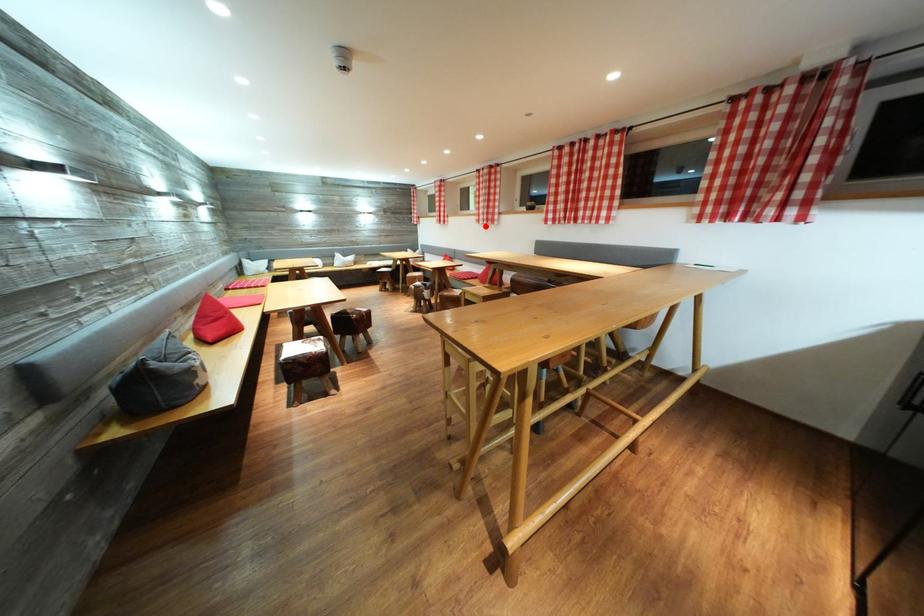
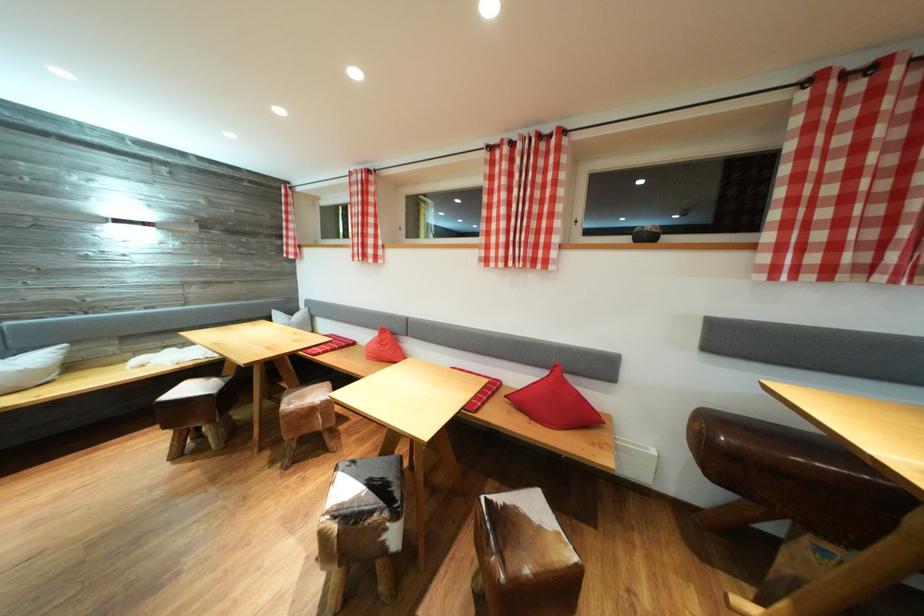
The point at the highlighted location is marked in the first image. Where is the corresponding point in the second image?

(492, 265)